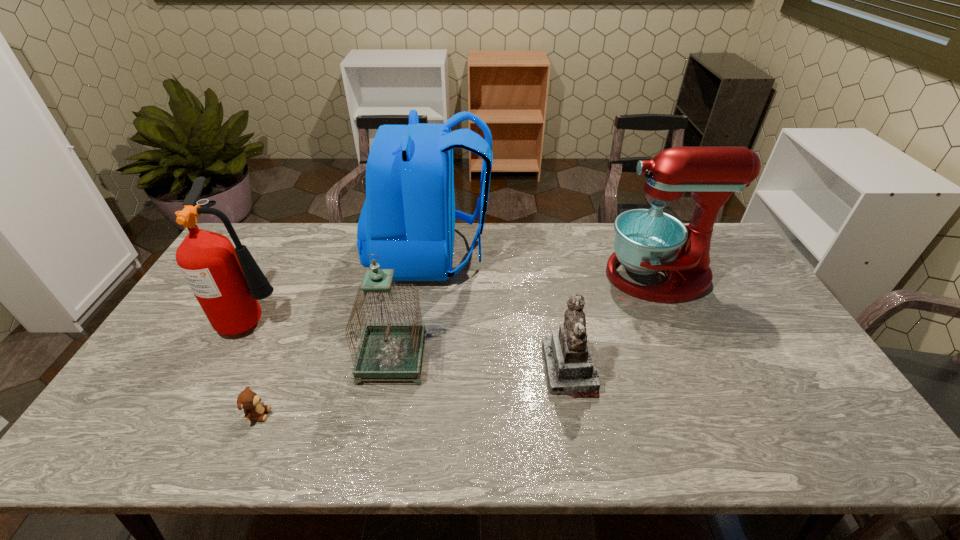
Locate an element on the screen. This screenshot has width=960, height=540. vacant space located 0.150m on the front-facing side of the mixer is located at coordinates (559, 276).

Identify the location of blank space located on the front-facing side of the mixer. This screenshot has height=540, width=960. (586, 276).

Identify the location of vacant region located at the nozzle of the fire extinguisher. The width and height of the screenshot is (960, 540). (310, 318).

In order to click on vacant space located 0.150m at the door of the fourth tallest object in this screenshot , I will do `click(480, 359)`.

This screenshot has width=960, height=540. In order to click on free point located on the front-facing side of the figurine in this screenshot , I will do `click(431, 370)`.

Identify the location of vacant space located on the front-facing side of the figurine. The height and width of the screenshot is (540, 960). (526, 370).

Locate an element on the screen. This screenshot has height=540, width=960. vacant space situated 0.330m on the front-facing side of the figurine is located at coordinates 420,370.

At what (x,y) coordinates should I click in order to perform the action: click on vacant space located 0.090m on the face of the shortest object. Please return your answer as a coordinate pair (x, y). Image resolution: width=960 pixels, height=540 pixels. Looking at the image, I should click on (306, 414).

Locate an element on the screen. This screenshot has width=960, height=540. backpack that is at the far edge is located at coordinates (408, 218).

Identify the location of mixer at the far edge. This screenshot has width=960, height=540. (647, 241).